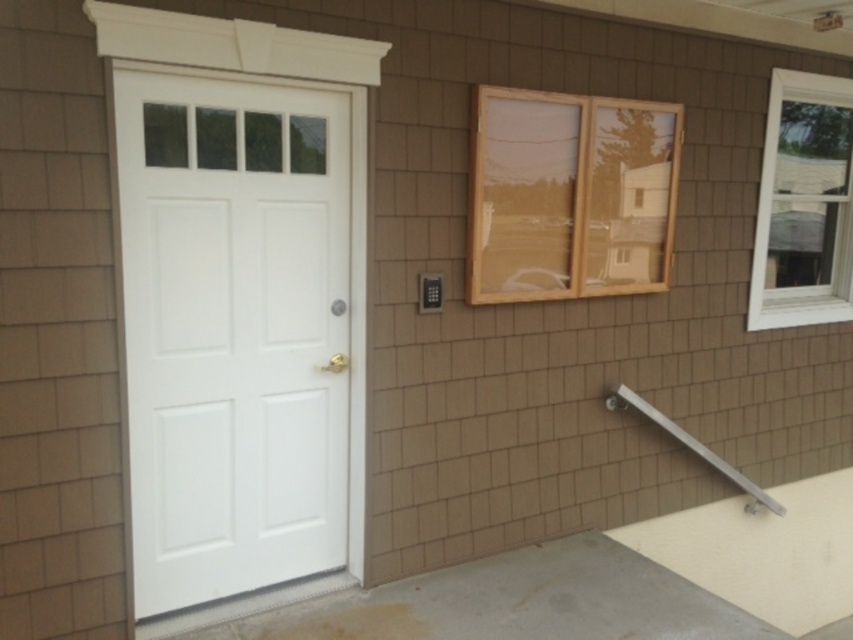
Is point (503, 209) farther from viewer compared to point (618, 406)?

That is False.

Can you confirm if clear glass window at center is wider than silver metallic handrail at lower right?

No.

Does point (648, 285) lie behind point (747, 493)?

No, it is in front of (747, 493).

Where is `clear glass window at center`? clear glass window at center is located at coordinates (569, 195).

Who is positioned more to the left, white painted wood screen door at left or white plastic window at upper right?

white painted wood screen door at left

The image size is (853, 640). What do you see at coordinates (233, 332) in the screenshot?
I see `white painted wood screen door at left` at bounding box center [233, 332].

The height and width of the screenshot is (640, 853). What are the coordinates of `white painted wood screen door at left` in the screenshot? It's located at (233, 332).

From the picture: Who is more distant from viewer, (x=611, y=212) or (x=839, y=202)?

The point (x=839, y=202) is more distant.

Is clear glass window at center below white plastic window at upper right?

Correct, clear glass window at center is located below white plastic window at upper right.

Is point (473, 228) behind point (769, 292)?

No, it is in front of (769, 292).

I want to click on clear glass window at center, so click(569, 195).